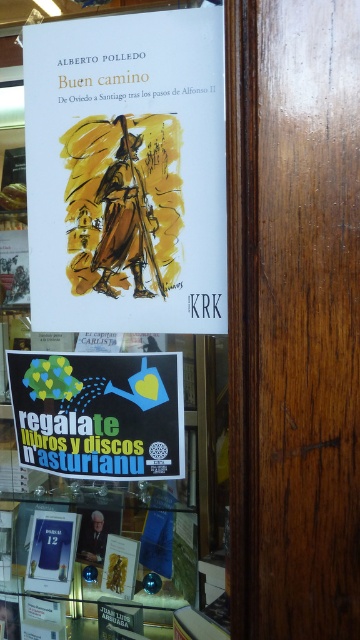
You are a customer in the bookstore and see the point at coordinates (114, 292). Which object is this point located on?

The point at coordinates (114, 292) is located on the white paper book at upper center.

You are an interior designer planning to hang a new decorative item between the white paper book at upper center and the black paper poster at lower center. Based on their widths, which object should you place closer to the center of the display to maintain visual balance?

The white paper book at upper center is wider than the black paper poster at lower center. To maintain visual balance, place the wider white paper book at upper center closer to the center of the display and the narrower black paper poster at lower center further away.